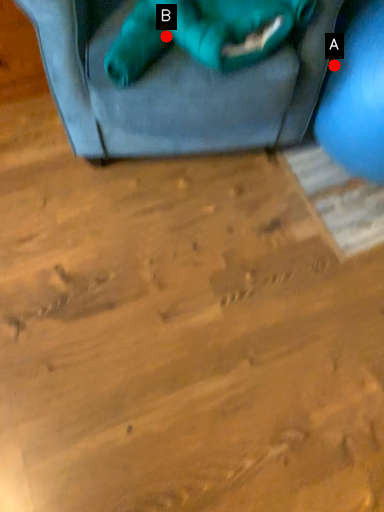
Question: Two points are circled on the image, labeled by A and B beside each circle. Which of the following is the farthest from the observer?

Choices:
 (A) A is further
 (B) B is further

Answer: (A)